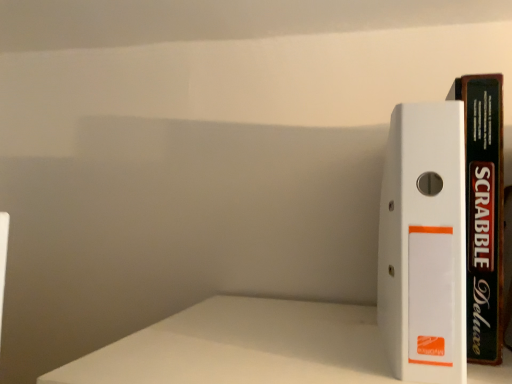
Question: Is white plastic binder at right, the 2th book positioned from the right, at the right side of black matte scrabble deluxe at right, the 2th book in the left-to-right sequence?

Choices:
 (A) yes
 (B) no

Answer: (B)

Question: From a real-world perspective, is white plastic binder at right, which is counted as the first book, starting from the left, beneath black matte scrabble deluxe at right, the 2th book in the left-to-right sequence?

Choices:
 (A) yes
 (B) no

Answer: (A)

Question: From the image's perspective, is white plastic binder at right, the 2th book positioned from the right, above black matte scrabble deluxe at right, the 2th book in the left-to-right sequence?

Choices:
 (A) yes
 (B) no

Answer: (B)

Question: Considering the relative sizes of white plastic binder at right, the 2th book positioned from the right, and black matte scrabble deluxe at right, which is counted as the first book, starting from the right, in the image provided, is white plastic binder at right, the 2th book positioned from the right, bigger than black matte scrabble deluxe at right, which is counted as the first book, starting from the right,?

Choices:
 (A) yes
 (B) no

Answer: (A)

Question: Is white plastic binder at right, which is counted as the first book, starting from the left, oriented towards black matte scrabble deluxe at right, the 2th book in the left-to-right sequence?

Choices:
 (A) no
 (B) yes

Answer: (A)

Question: From a real-world perspective, is white plastic binder at right, the 2th book positioned from the right, on black matte scrabble deluxe at right, the 2th book in the left-to-right sequence?

Choices:
 (A) yes
 (B) no

Answer: (B)

Question: Is the position of black matte scrabble deluxe at right, the 2th book in the left-to-right sequence, less distant than that of white plastic binder at right, the 2th book positioned from the right?

Choices:
 (A) yes
 (B) no

Answer: (B)

Question: Is black matte scrabble deluxe at right, which is counted as the first book, starting from the right, next to white plastic binder at right, the 2th book positioned from the right, and touching it?

Choices:
 (A) yes
 (B) no

Answer: (A)

Question: Is black matte scrabble deluxe at right, the 2th book in the left-to-right sequence, far from white plastic binder at right, which is counted as the first book, starting from the left?

Choices:
 (A) no
 (B) yes

Answer: (A)

Question: Can you confirm if black matte scrabble deluxe at right, the 2th book in the left-to-right sequence, is thinner than white plastic binder at right, the 2th book positioned from the right?

Choices:
 (A) yes
 (B) no

Answer: (A)

Question: Can white plastic binder at right, the 2th book positioned from the right, be found inside black matte scrabble deluxe at right, the 2th book in the left-to-right sequence?

Choices:
 (A) no
 (B) yes

Answer: (A)

Question: Can you confirm if black matte scrabble deluxe at right, the 2th book in the left-to-right sequence, is shorter than white plastic binder at right, which is counted as the first book, starting from the left?

Choices:
 (A) no
 (B) yes

Answer: (A)

Question: In the image, is black matte scrabble deluxe at right, the 2th book in the left-to-right sequence, positioned in front of or behind white plastic binder at right, which is counted as the first book, starting from the left?

Choices:
 (A) front
 (B) behind

Answer: (B)